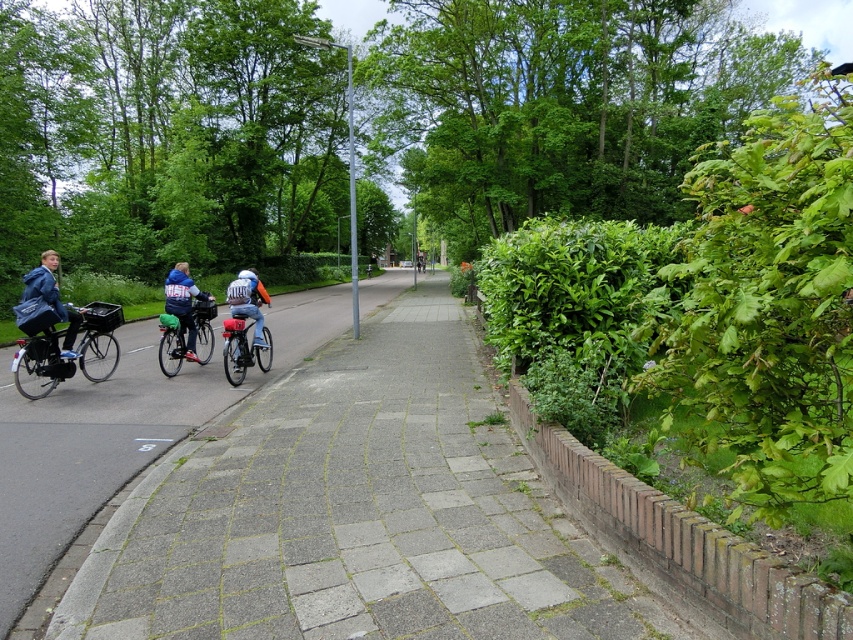
Question: Which object is the farthest from the gray concrete pavement at center?

Choices:
 (A) blue denim jacket at center
 (B) blue denim jacket at left

Answer: (B)

Question: Can you confirm if matte blue helmet at center is positioned to the right of blue denim jacket at left?

Choices:
 (A) no
 (B) yes

Answer: (B)

Question: Which point is closer to the camera taking this photo?

Choices:
 (A) (202, 419)
 (B) (241, 344)
 (C) (238, 301)

Answer: (A)

Question: Is blue denim jacket at center smaller than matte blue helmet at center?

Choices:
 (A) no
 (B) yes

Answer: (B)

Question: Can you confirm if matte black bicycle at left is bigger than blue denim jacket at center?

Choices:
 (A) no
 (B) yes

Answer: (B)

Question: Which of the following is the farthest from the observer?

Choices:
 (A) (71, 324)
 (B) (83, 496)

Answer: (A)